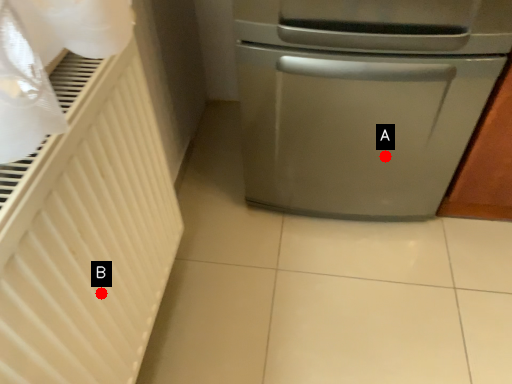
Question: Two points are circled on the image, labeled by A and B beside each circle. Among these points, which one is farthest from the camera?

Choices:
 (A) A is further
 (B) B is further

Answer: (A)